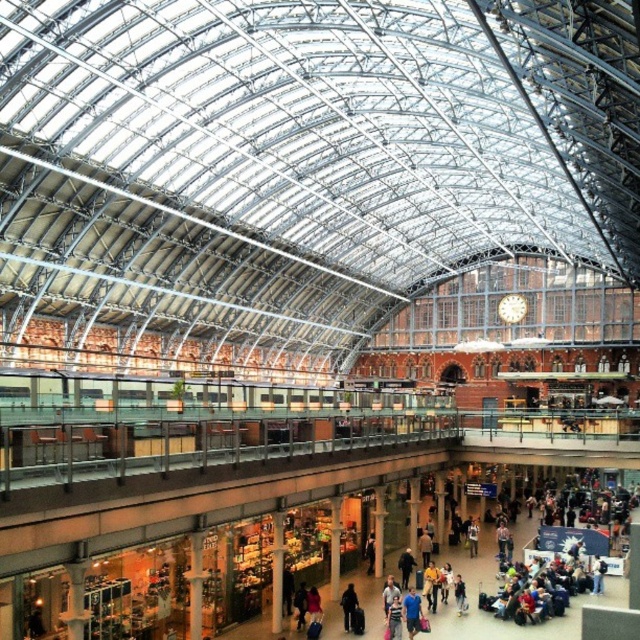
Question: Does dark brown leather jacket at center appear on the right side of blue denim jeans at center?

Choices:
 (A) no
 (B) yes

Answer: (A)

Question: Based on their relative distances, which object is farther from the dark blue jeans at center?

Choices:
 (A) dark brown leather jacket at center
 (B) blue cotton shirt at lower center
 (C) blue denim jeans at center

Answer: (C)

Question: Which point is closer to the camera?

Choices:
 (A) (348, 618)
 (B) (394, 620)

Answer: (B)

Question: Which point is closer to the camera?

Choices:
 (A) dark blue jeans at center
 (B) blue denim jeans at center

Answer: (B)

Question: Observing the image, what is the correct spatial positioning of blue cotton shirt at lower center in reference to blue denim jeans at center?

Choices:
 (A) above
 (B) below

Answer: (B)

Question: Considering the relative positions of blue cotton shirt at lower center and dark blue jeans at center in the image provided, where is blue cotton shirt at lower center located with respect to dark blue jeans at center?

Choices:
 (A) below
 (B) above

Answer: (A)